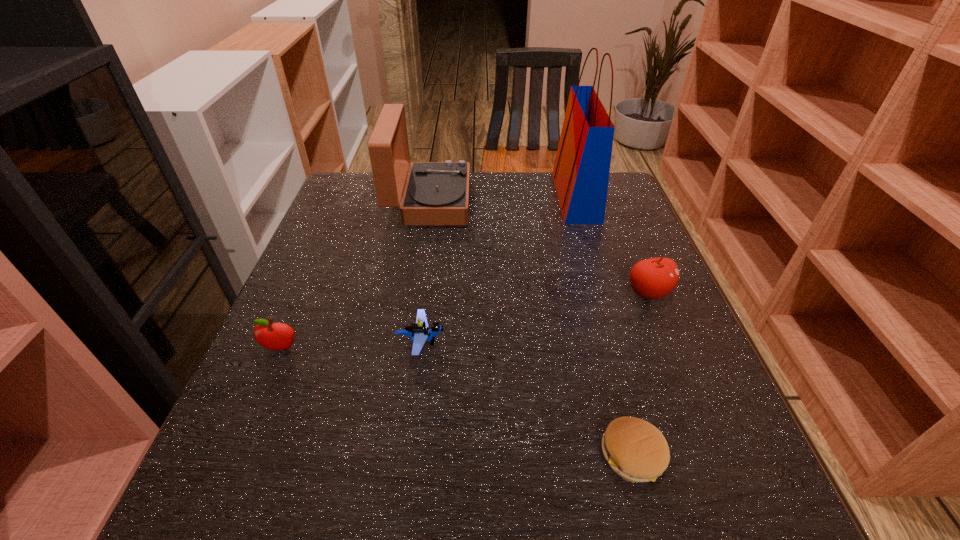
In order to click on object present at the left edge in this screenshot , I will do `click(274, 336)`.

The image size is (960, 540). In order to click on shopping bag located at the right edge in this screenshot , I will do pyautogui.click(x=581, y=171).

Image resolution: width=960 pixels, height=540 pixels. I want to click on apple located at the right edge, so click(654, 278).

Identify the location of patty that is at the right edge. (636, 450).

Image resolution: width=960 pixels, height=540 pixels. What are the coordinates of `object positioned at the far right corner` in the screenshot? It's located at (x=581, y=171).

You are a GUI agent. You are given a task and a screenshot of the screen. Output one action in this format:
    pyautogui.click(x=<x>, y=<y>)
    Task: Click on the object at the near right corner
    The height and width of the screenshot is (540, 960).
    Given the screenshot: What is the action you would take?
    pyautogui.click(x=636, y=450)

In the image, there is a desktop. Where is `free region at the near edge`? The width and height of the screenshot is (960, 540). free region at the near edge is located at coordinates (392, 502).

At what (x,y) coordinates should I click in order to perform the action: click on free region at the left edge of the desktop. Please return your answer as a coordinate pair (x, y). Looking at the image, I should click on (258, 377).

Locate an element on the screen. vacant space at the right edge of the desktop is located at coordinates (601, 257).

Locate an element on the screen. free space at the near left corner is located at coordinates (282, 501).